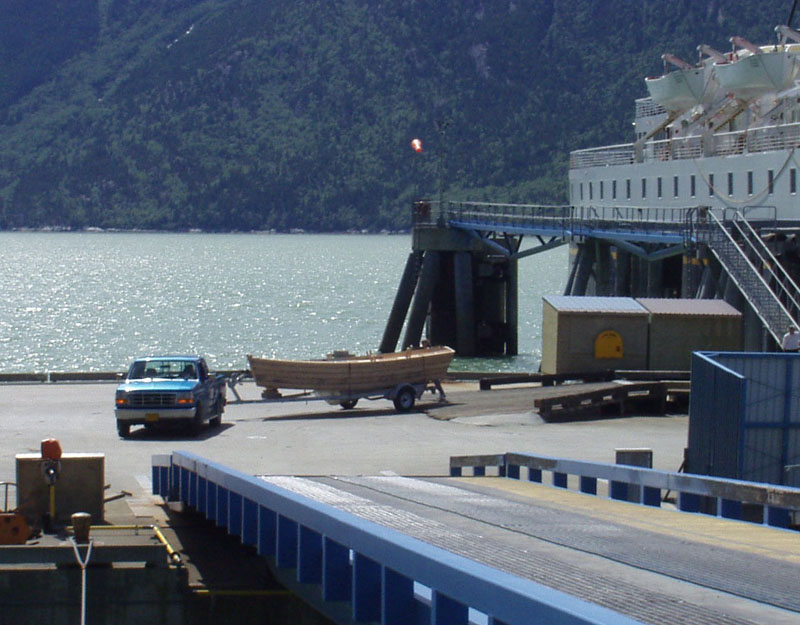
What are the coordinates of `stairs` in the screenshot? It's located at (777, 321), (748, 277), (726, 251).